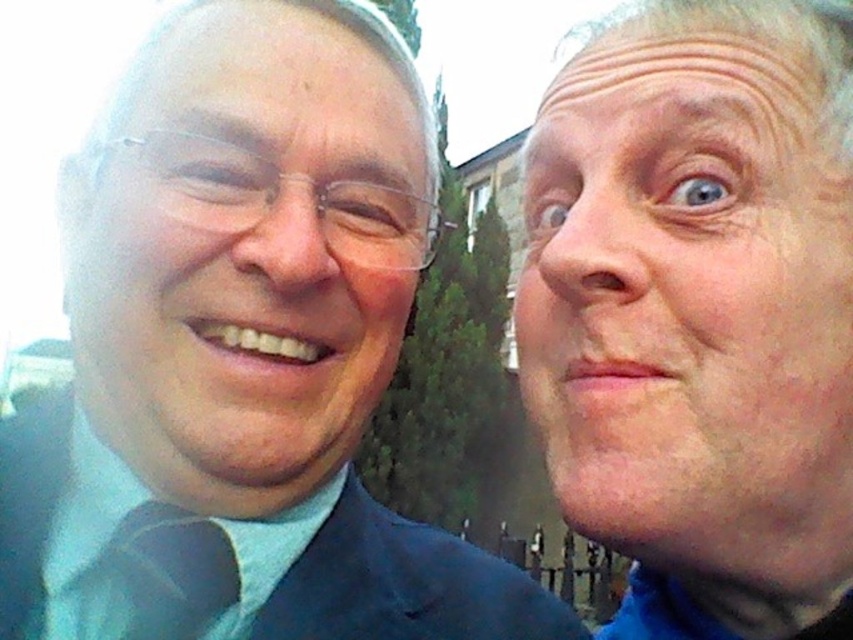
You are a photographer trying to adjust the lighting for a portrait. You notice the pale skin at right and the matte blue tie at left in the frame. Which object is covering part of the other?

The pale skin at right is positioned over matte blue tie at left, so the pale skin at right is covering part of the matte blue tie at left.

You are trying to identify the location of the dark blue fabric suit at left in the image. The coordinates given are point [405,586]. Based on the scene description, can you confirm if this point is correctly placed on the dark blue fabric suit at left?

Yes, the point [405,586] corresponds to the dark blue fabric suit at left as described.

You are a photographer trying to adjust the lighting for a group photo. You notice two faces in the frame, the pale skin at right and the matte black face at left. Which face might require more fill light to balance the exposure?

The pale skin at right might require more fill light because it is shorter than the matte black face at left, making it potentially underexposed compared to the larger area.